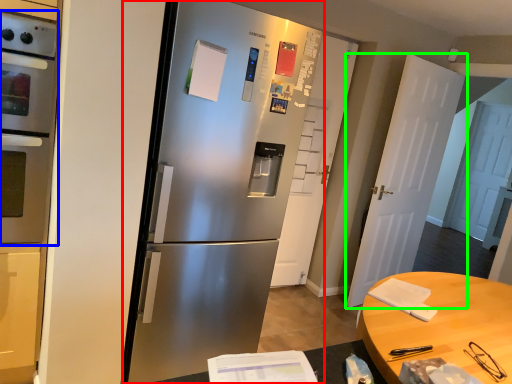
Question: Considering the real-world distances, which object is closest to refrigerator (highlighted by a red box)? oven (highlighted by a blue box) or door (highlighted by a green box).

Choices:
 (A) oven
 (B) door

Answer: (A)